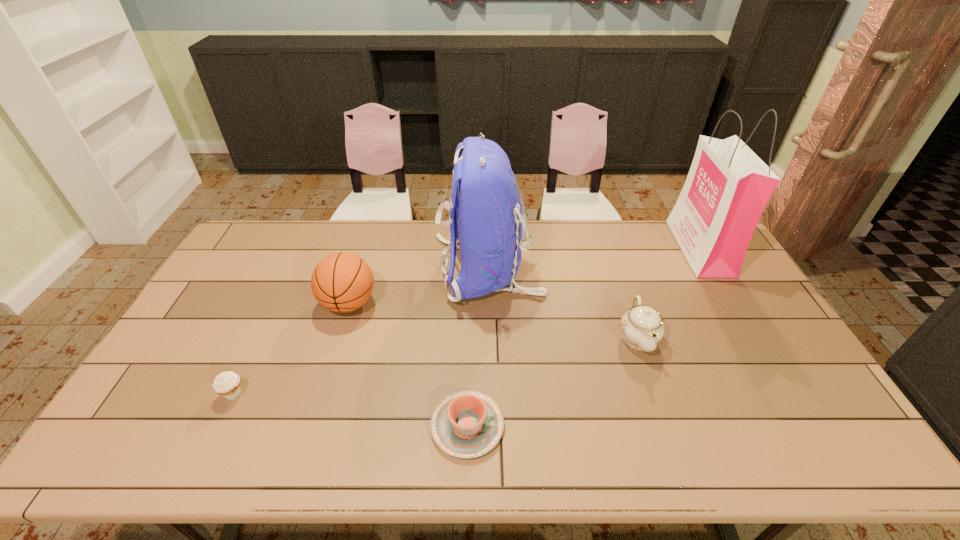
Image resolution: width=960 pixels, height=540 pixels. In order to click on shopping bag in this screenshot , I will do `click(728, 186)`.

The image size is (960, 540). In order to click on backpack in this screenshot , I will do `click(486, 216)`.

I want to click on basketball, so click(x=341, y=282).

At what (x,y) coordinates should I click in order to perform the action: click on the third tallest object. Please return your answer as a coordinate pair (x, y). Looking at the image, I should click on (341, 282).

Where is `the farther chinaware`? This screenshot has height=540, width=960. the farther chinaware is located at coordinates (642, 327).

Identify the location of the taller chinaware. The height and width of the screenshot is (540, 960). (642, 327).

Find the location of `the fifth tallest object`. the fifth tallest object is located at coordinates (227, 384).

This screenshot has height=540, width=960. Find the location of `the leftmost object`. the leftmost object is located at coordinates (227, 384).

Where is `the left chinaware`? The image size is (960, 540). the left chinaware is located at coordinates (467, 424).

I want to click on the nearer chinaware, so click(x=467, y=424).